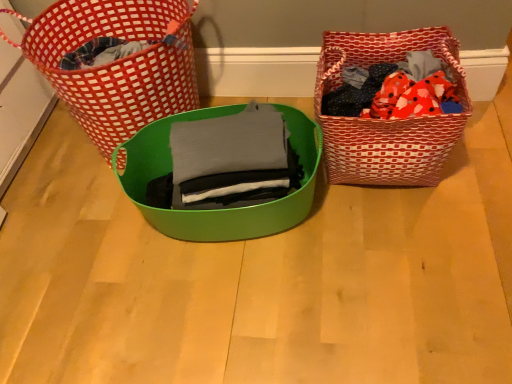
Question: From a real-world perspective, is red woven picnic basket at left, the first picnic basket positioned from the left, above or below red woven picnic basket at right, which is counted as the first picnic basket, starting from the right?

Choices:
 (A) below
 (B) above

Answer: (B)

Question: From the image's perspective, is red woven picnic basket at left, the first picnic basket positioned from the left, positioned above or below red woven picnic basket at right, which is the second picnic basket from left to right?

Choices:
 (A) below
 (B) above

Answer: (B)

Question: Which object is the farthest from the gray matte fabric at center?

Choices:
 (A) red woven picnic basket at left, the first picnic basket positioned from the left
 (B) red woven picnic basket at right, which is counted as the first picnic basket, starting from the right
 (C) green plastic bowl at center

Answer: (A)

Question: Estimate the real-world distances between objects in this image. Which object is farther from the red woven picnic basket at left, the 2th picnic basket positioned from the right?

Choices:
 (A) green plastic bowl at center
 (B) red woven picnic basket at right, which is the second picnic basket from left to right
 (C) gray matte fabric at center

Answer: (B)